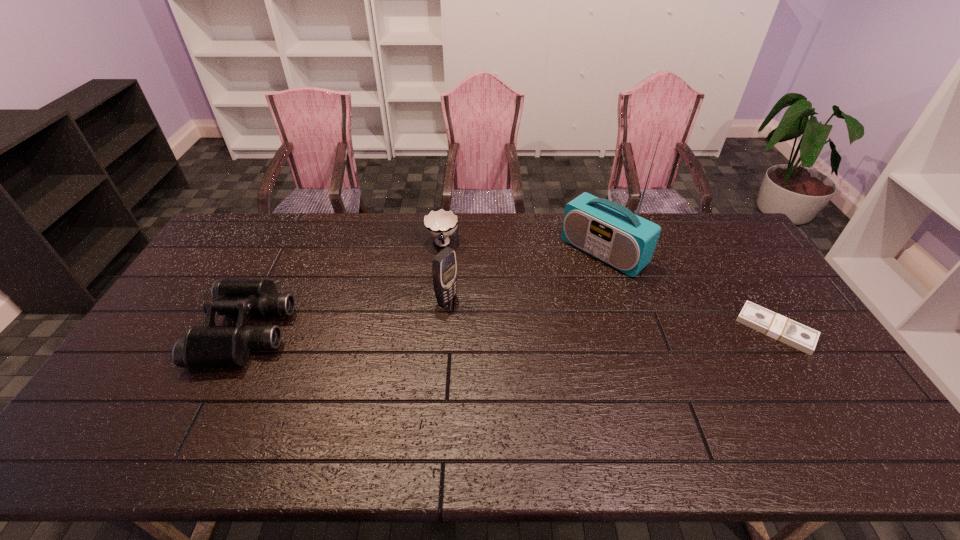
Identify the location of radio receiver situated at the far edge. This screenshot has height=540, width=960. click(x=612, y=233).

You are a GUI agent. You are given a task and a screenshot of the screen. Output one action in this format:
    pyautogui.click(x=<x>, y=<y>)
    Task: Click on the cup that is positioned at the far edge
    
    Given the screenshot: What is the action you would take?
    pos(440,224)

You are a GUI agent. You are given a task and a screenshot of the screen. Output one action in this format:
    pyautogui.click(x=<x>, y=<y>)
    Task: Click on the object that is at the left edge
    The image size is (960, 540).
    Given the screenshot: What is the action you would take?
    pyautogui.click(x=207, y=346)

You are a GUI agent. You are given a task and a screenshot of the screen. Output one action in this format:
    pyautogui.click(x=<x>, y=<y>)
    Task: Click on the object that is at the right edge
    This screenshot has width=960, height=540.
    Given the screenshot: What is the action you would take?
    pyautogui.click(x=774, y=325)

What are the coordinates of `free space at the far edge of the desktop` in the screenshot? It's located at (324, 247).

Identify the location of vacant space at the near edge of the desktop. (178, 417).

Identify the location of free space at the far left corner. The width and height of the screenshot is (960, 540). (240, 240).

What are the coordinates of `vacant space that is in between the second shortest object and the dollar` in the screenshot? It's located at (609, 287).

Where is `vacant region between the second tallest object and the dollar`? The width and height of the screenshot is (960, 540). vacant region between the second tallest object and the dollar is located at coordinates (612, 314).

Identify the location of vacant space in between the cup and the tallest object. The width and height of the screenshot is (960, 540). (522, 248).